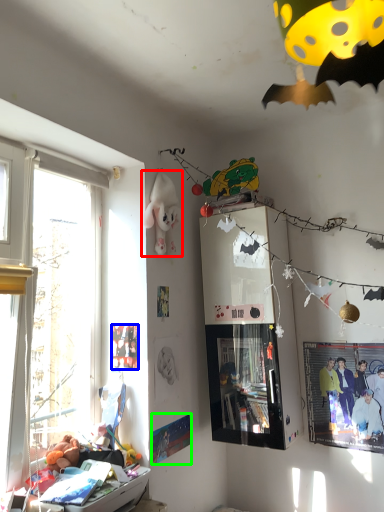
Question: Estimate the real-world distances between objects in this image. Which object is closer to toy (highlighted by a red box), poster page (highlighted by a blue box) or poster page (highlighted by a green box)?

Choices:
 (A) poster page
 (B) poster page

Answer: (A)